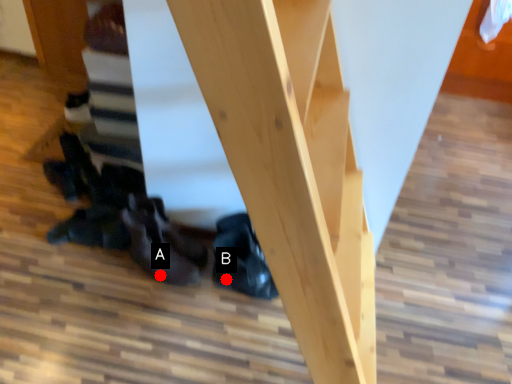
Question: Two points are circled on the image, labeled by A and B beside each circle. Which of the following is the closest to the observer?

Choices:
 (A) A is closer
 (B) B is closer

Answer: (A)